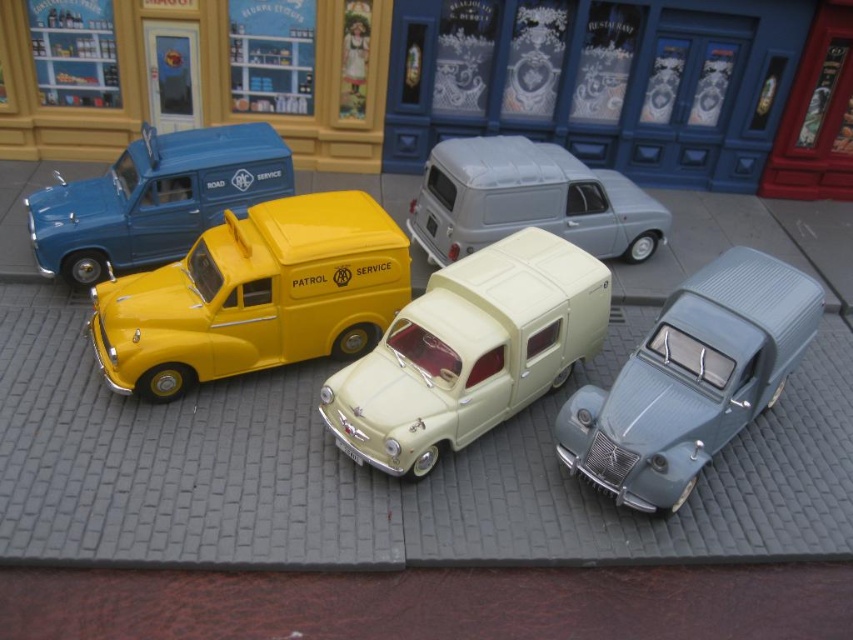
Question: Which object appears closest to the camera in this image?

Choices:
 (A) metallic blue car at lower right
 (B) matte blue van at left

Answer: (A)

Question: Is yellow matte van at center to the left of matte cream van at center from the viewer's perspective?

Choices:
 (A) yes
 (B) no

Answer: (A)

Question: Does matte blue van at left have a lesser width compared to matte gray van at center?

Choices:
 (A) yes
 (B) no

Answer: (A)

Question: Which is farther from the metallic blue car at lower right?

Choices:
 (A) yellow matte van at center
 (B) matte gray van at center
 (C) matte cream van at center
 (D) matte blue van at left

Answer: (D)

Question: Among these points, which one is nearest to the camera?

Choices:
 (A) (410, 227)
 (B) (370, 364)
 (C) (173, 282)
 (D) (84, 273)

Answer: (B)

Question: Can you confirm if metallic blue car at lower right is positioned to the left of matte gray van at center?

Choices:
 (A) yes
 (B) no

Answer: (B)